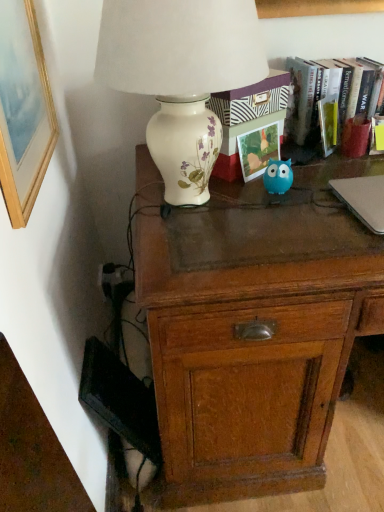
This screenshot has width=384, height=512. I want to click on free spot in front of matte paper photo frame at center, so click(x=264, y=199).